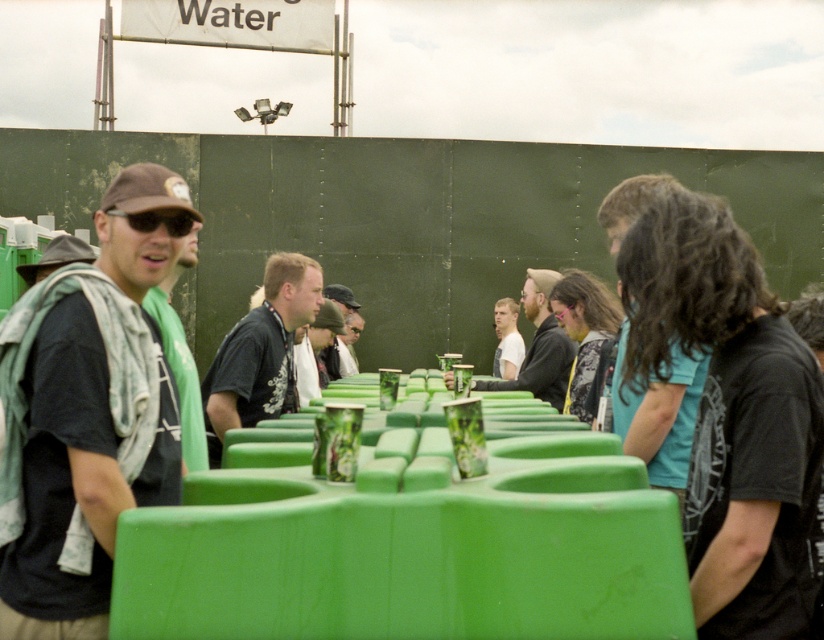
In the festival scene, there are two people wearing a matte black shirt at center and a dark gray fabric jacket at center. Which one is positioned to the right?

The matte black shirt at center is positioned to the right of the dark gray fabric jacket at center.

From the picture: You are a photographer taking a picture of the crowd at the festival. You notice the matte black shirt at center and the dark gray fabric jacket at center. Which clothing item is positioned higher on the person wearing them?

The matte black shirt at center is located above the dark gray fabric jacket at center, so the matte black shirt at center is positioned higher on the person wearing them.